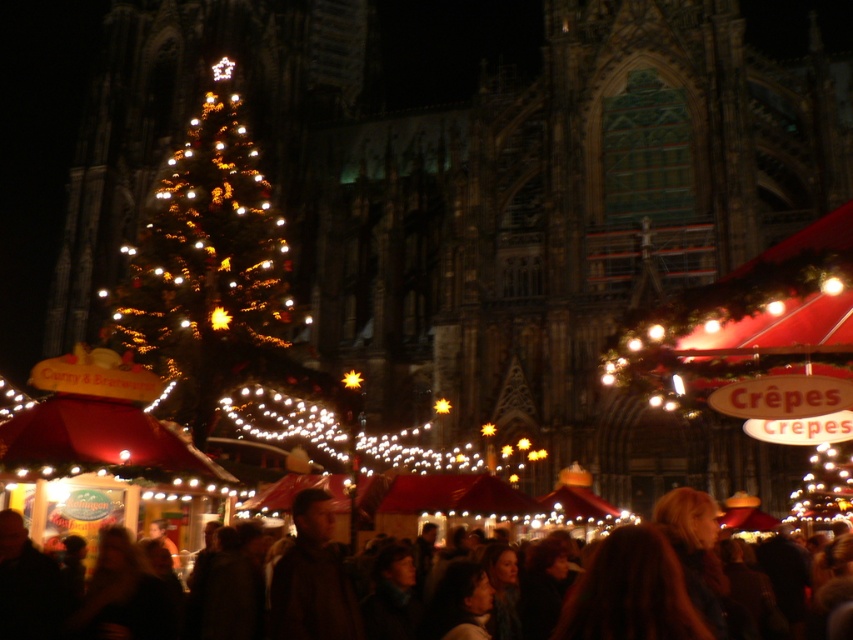
You are standing at the entrance of the Gothic cathedral facing the Christmas market. You want to find the illuminated gold christmas tree at center. Based on the coordinates provided, in which direction should you look to spot it?

The illuminated gold christmas tree at center is located at coordinates point (209, 269). Since the coordinates are relative to the image, the tree is positioned slightly to the right and lower middle area of the scene. Therefore, you should look towards the right side and slightly downward from the center to locate it.

You are a visitor at the Christmas market and want to take a photo of the illuminated gold christmas tree at center without anyone in the frame. There is a person with dark brown hair at lower center blocking your view. According to the scene description, which direction should you move to ensure the person is no longer blocking the tree?

Move to the right of the dark brown hair at lower center so the illuminated gold christmas tree at center comes into view to your left, as the tree is positioned to the left of the person.